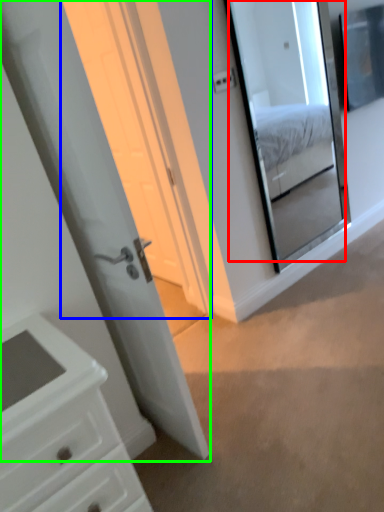
Question: Considering the real-world distances, which object is farthest from mirror (highlighted by a red box)? screen door (highlighted by a blue box) or door (highlighted by a green box)?

Choices:
 (A) screen door
 (B) door

Answer: (B)